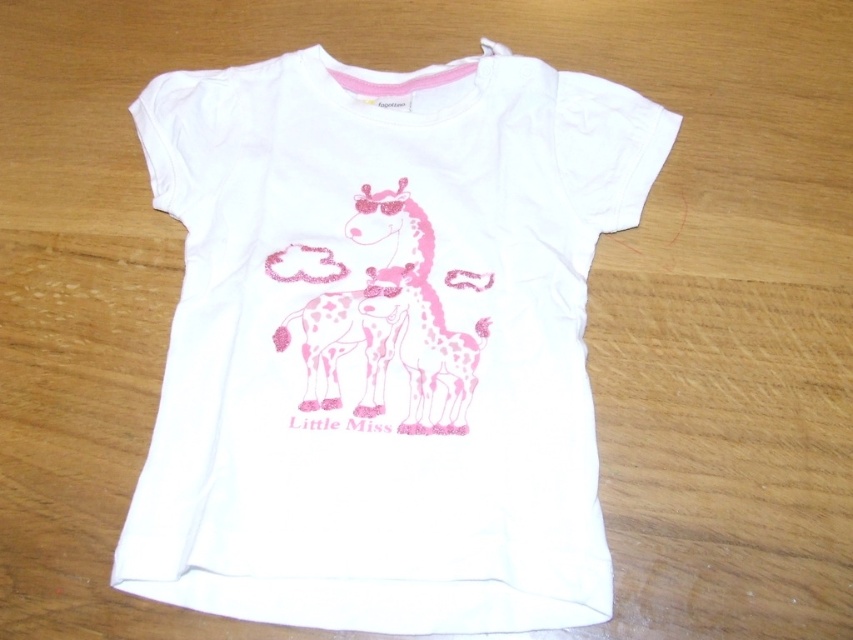
Based on the photo, does white matte t-shirt at center have a greater width compared to pink glittery giraffe at center?

Yes.

Which is in front, point (281, 436) or point (419, 369)?

Point (281, 436) is more forward.

Which is in front, point (215, 524) or point (419, 344)?

Point (215, 524)

Locate an element on the screen. white matte t-shirt at center is located at coordinates (383, 340).